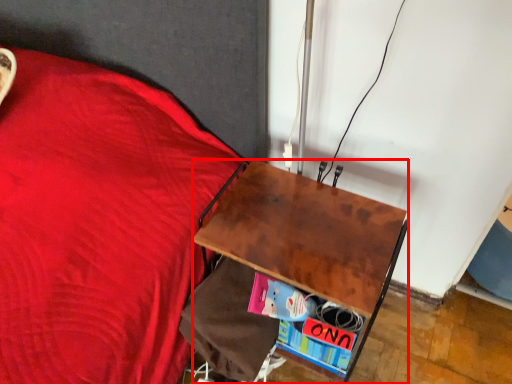
Question: From the image, what is the correct spatial relationship of desk (annotated by the red box) in relation to paperback book?

Choices:
 (A) right
 (B) left

Answer: (B)